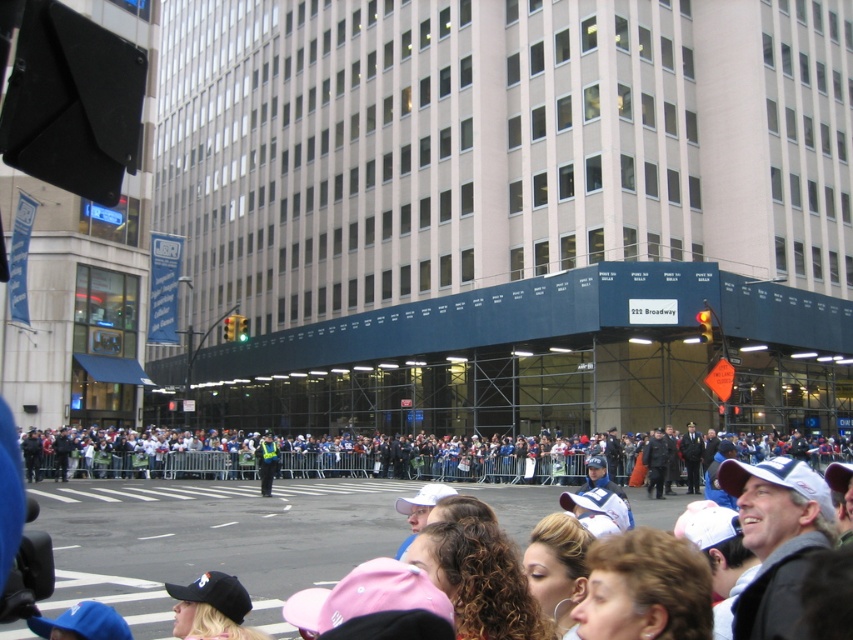
You are standing at the point with coordinates (434, 460) in the image. Based on the scene description, what object are you most likely standing on?

The point with coordinates (434, 460) is on the white plastic crowd at center, so you are most likely standing on the white plastic crowd at center.

You are a delivery person needing to cross the street quickly. The traffic light is green, but there is a white plastic crowd at center and a reflective yellow vest at center in your path. Can you safely pass through the area between them within 10 seconds?

The distance between the white plastic crowd at center and the reflective yellow vest at center is 34.91 feet. Assuming an average walking speed of 3 feet per second, it would take approximately 11.6 seconds to cross the distance. Therefore, you cannot safely pass through within 10 seconds.